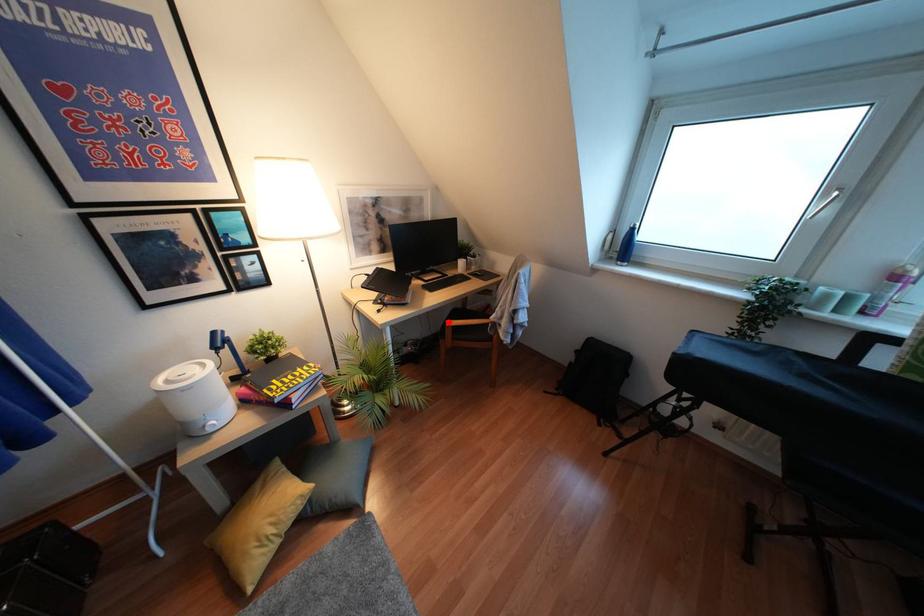
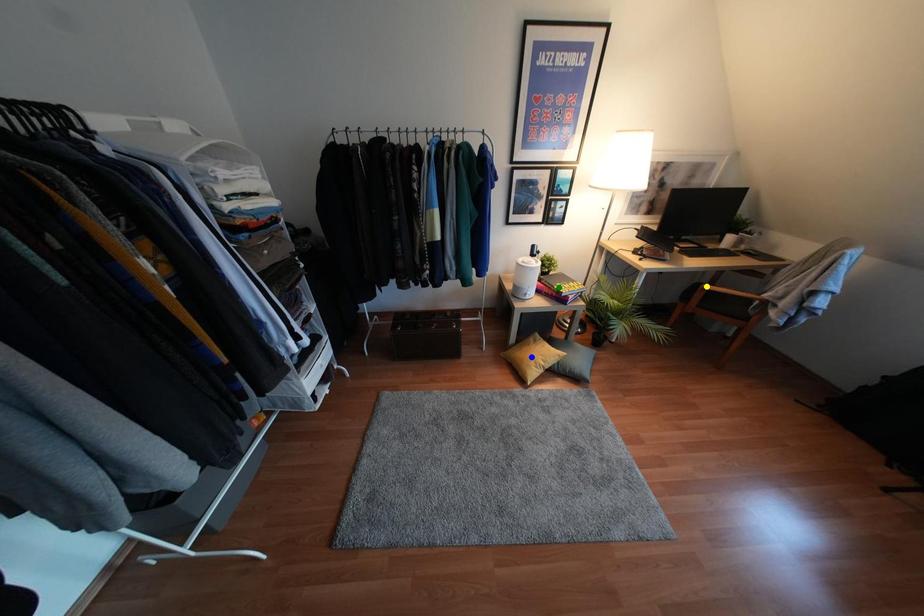
Question: I am providing you with two images of the same scene from different viewpoints. A red point is marked on the first image. You are given multiple points on the second image. In image 2, which mark is for the same physical point as the one in image 1?

Choices:
 (A) blue point
 (B) yellow point
 (C) green point

Answer: (B)